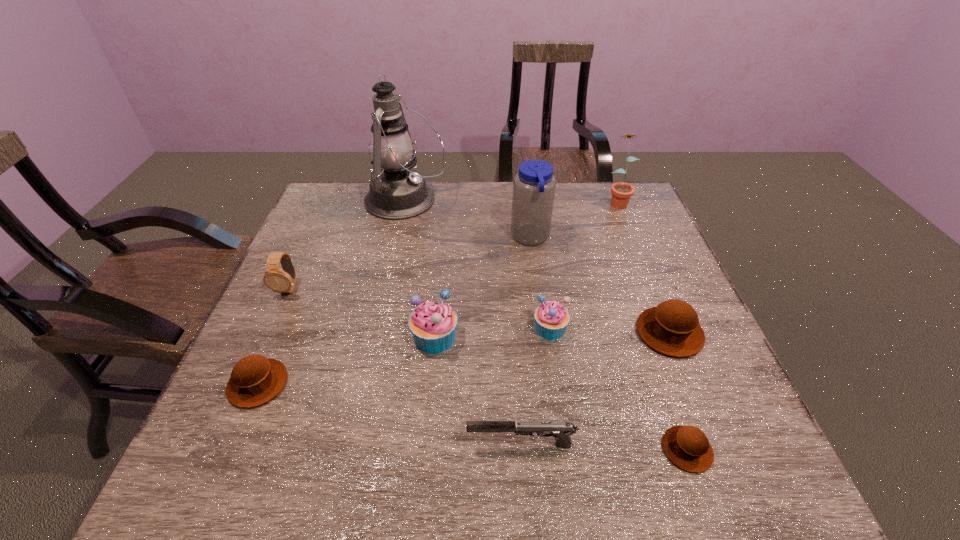
This screenshot has height=540, width=960. Find the location of `blank area located on the right of the tallest muffin`. blank area located on the right of the tallest muffin is located at coordinates (516, 337).

Where is `free space located 0.300m on the face of the watch`? free space located 0.300m on the face of the watch is located at coordinates (235, 407).

Locate an element on the screen. The width and height of the screenshot is (960, 540). free region located on the back of the right blue muffin is located at coordinates (537, 235).

Where is `vacant region located on the back of the biggest brown muffin`? vacant region located on the back of the biggest brown muffin is located at coordinates (636, 249).

Locate an element on the screen. free region located 0.090m at the muzzle end of the gun is located at coordinates (419, 445).

Locate an element on the screen. free space located 0.280m at the muzzle end of the gun is located at coordinates (317, 445).

Locate an element on the screen. Image resolution: width=960 pixels, height=540 pixels. vacant region located 0.360m at the muzzle end of the gun is located at coordinates pos(274,445).

Locate an element on the screen. The height and width of the screenshot is (540, 960). free space located on the right of the leftmost brown muffin is located at coordinates (407, 384).

Identify the location of free space located 0.360m on the left of the smallest brown muffin. Image resolution: width=960 pixels, height=540 pixels. (468, 450).

This screenshot has width=960, height=540. Identify the location of oil lamp that is at the far edge. (396, 192).